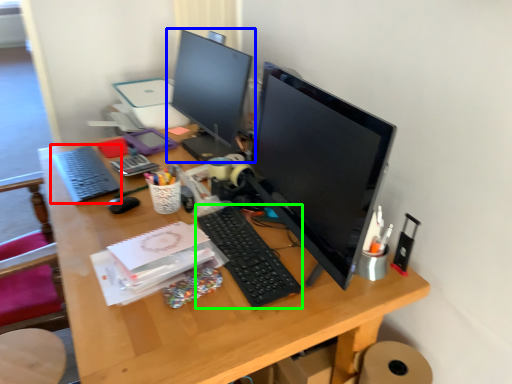
Question: Based on their relative distances, which object is farther from computer keyboard (highlighted by a red box)? Choose from computer monitor (highlighted by a blue box) and computer keyboard (highlighted by a green box).

Choices:
 (A) computer monitor
 (B) computer keyboard

Answer: (B)